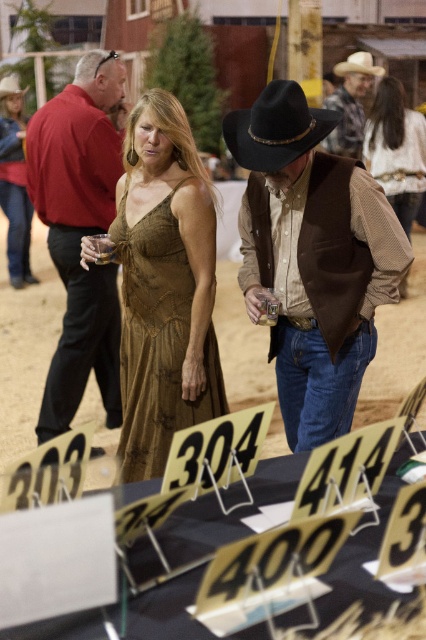
Is point (402, 184) behind point (336, 132)?

No.

The image size is (426, 640). What do you see at coordinates (397, 150) in the screenshot?
I see `white textured shirt at upper right` at bounding box center [397, 150].

Does point (385, 154) come farther from viewer compared to point (356, 145)?

No.

At what (x,y) coordinates should I click in order to perform the action: click on white textured shirt at upper right. Please return your answer as a coordinate pair (x, y). Looking at the image, I should click on (397, 150).

Which is above, brown suede cowboy hat at center or white textured shirt at upper right?

white textured shirt at upper right is above.

Is point (264, 276) in front of point (371, 109)?

That is True.

Image resolution: width=426 pixels, height=640 pixels. What are the coordinates of `brown suede cowboy hat at center` in the screenshot? It's located at (313, 257).

Does point (224, 336) come behind point (85, 74)?

That is True.

Consider the image. Between brown dirt track at center and matte red shirt at center, which one has less height?

With less height is brown dirt track at center.

Locate an element on the screen. This screenshot has height=640, width=426. brown dirt track at center is located at coordinates click(25, 348).